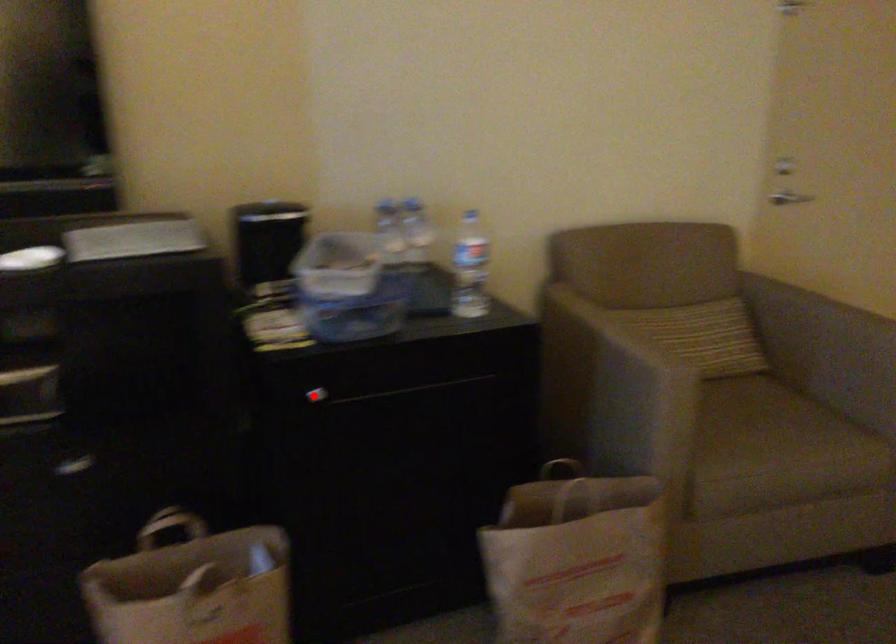
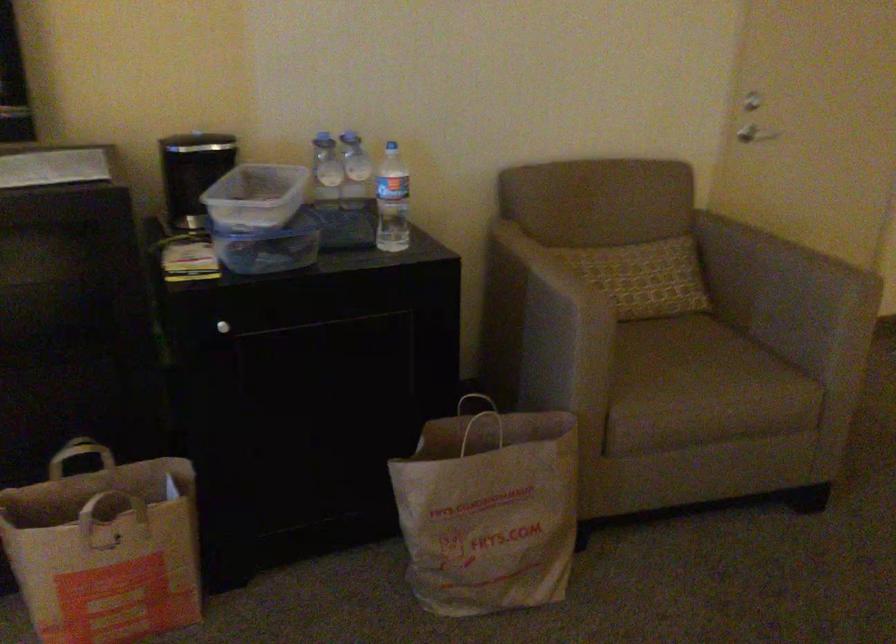
The point at the highlighted location is marked in the first image. Where is the corresponding point in the second image?

(222, 327)